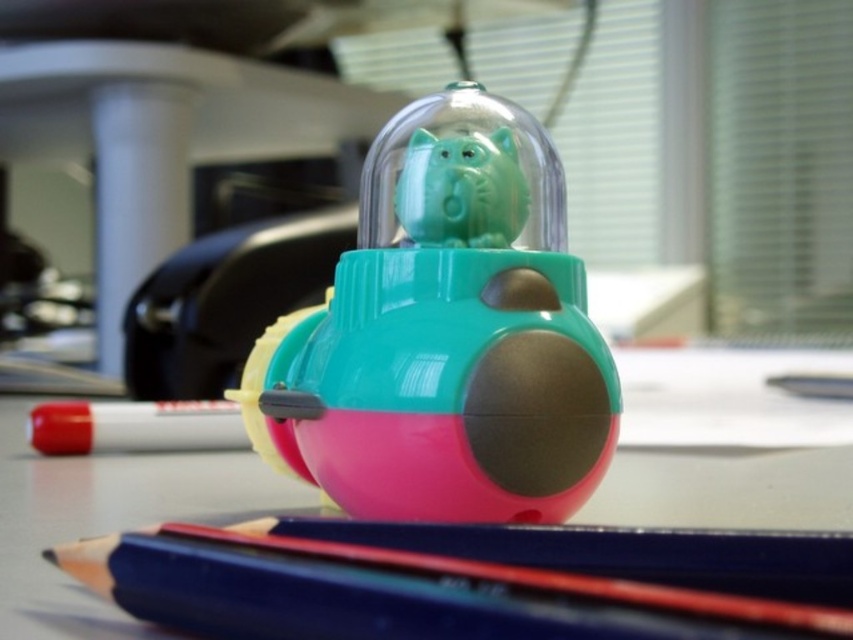
You are organizing a desk and see the pink rubber eraser at center and the matte green plastic piggy bank at center. Which one is more to the left?

The pink rubber eraser at center is more to the left.

You have a small box that can only fit items wider than 3 centimeters. You need to place either the pink rubber eraser at center or the red matte marker at lower left into the box. Which item should you choose based on their widths?

The pink rubber eraser at center might be wider than red matte marker at lower left. If the eraser is indeed wider and exceeds 3 centimeters, it should be placed in the box. However, if its width is under 3 centimeters, neither would fit, but the question specifies the box fits items wider than 3cm, so assuming the eraser meets the requirement, choose it.

You want to place a ruler between the pink rubber eraser at center and the smooth blue pencil at center to measure the distance between them. Which object should the ruler start at and end at to measure the correct distance?

The ruler should start at the pink rubber eraser at center and end at the smooth blue pencil at center to measure the correct distance of 17.41 inches between them.